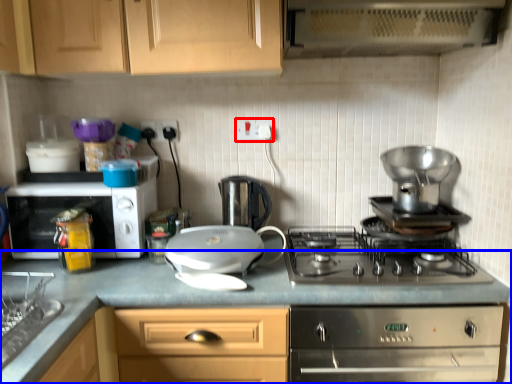
Question: Which object is further to the camera taking this photo, electric outlet (highlighted by a red box) or countertop (highlighted by a blue box)?

Choices:
 (A) electric outlet
 (B) countertop

Answer: (A)